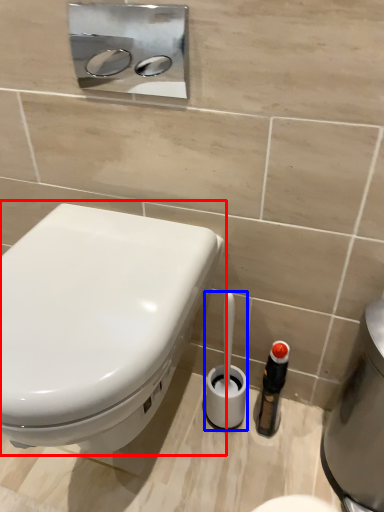
Question: Which of the following is the farthest to the observer, toilet (highlighted by a red box) or brush (highlighted by a blue box)?

Choices:
 (A) toilet
 (B) brush

Answer: (B)